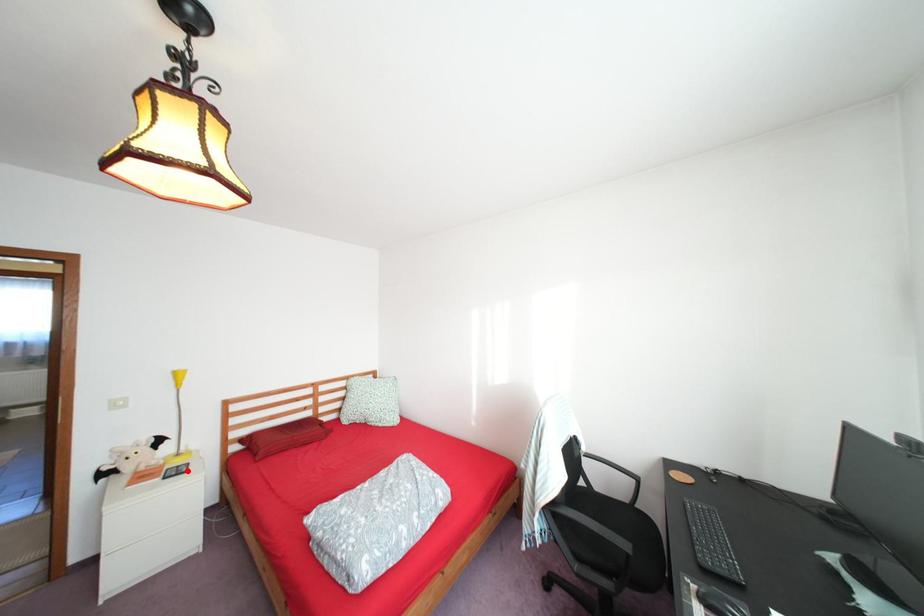
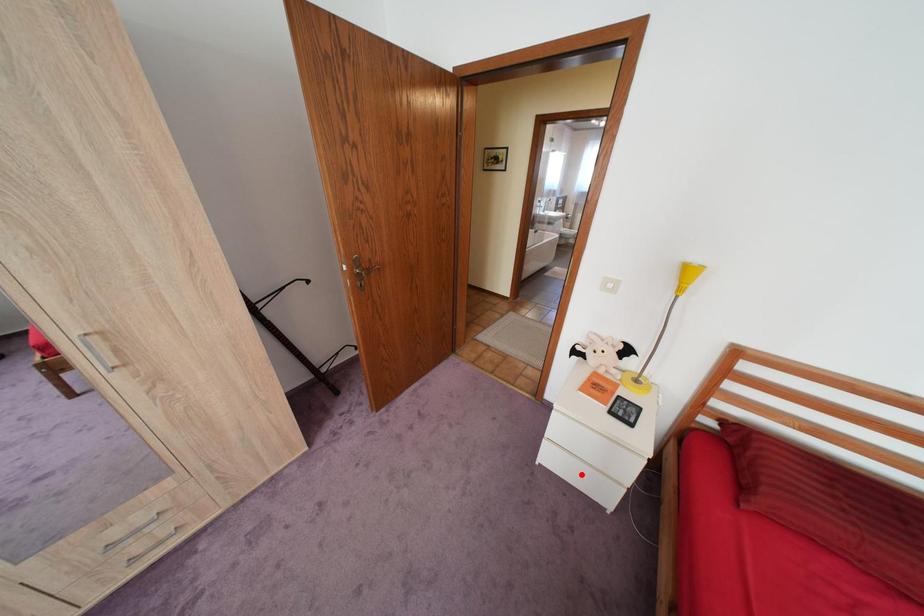
I am providing you with two images of the same scene from different viewpoints. A red point is marked on the first image and another point is marked on the second image. Are the points marked in image1 and image2 representing the same 3D position?

No